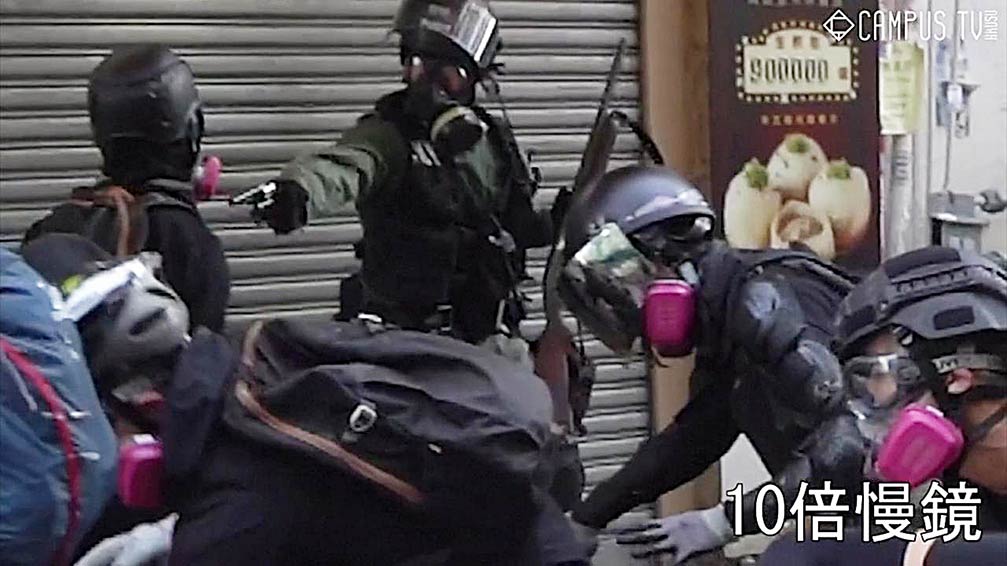
Image resolution: width=1007 pixels, height=566 pixels. Find the location of `handle`. handle is located at coordinates (368, 413).